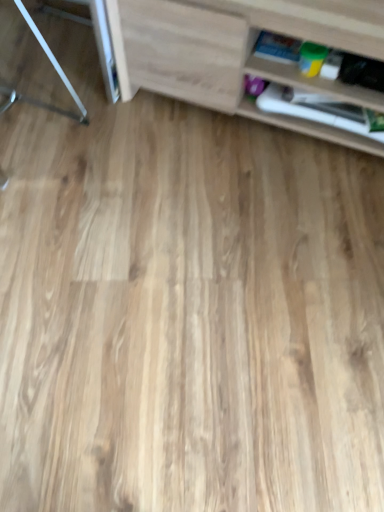
Question: From a real-world perspective, relative to wooden shelf at right, the 1th shelf when ordered from back to front, is metallic silver table at left vertically above or below?

Choices:
 (A) above
 (B) below

Answer: (A)

Question: Looking at the image, does metallic silver table at left seem bigger or smaller compared to wooden shelf at right, the 1th shelf when ordered from back to front?

Choices:
 (A) big
 (B) small

Answer: (A)

Question: Considering the real-world distances, which object is closest to the light wood cabinet at upper right, which appears as the second shelf when viewed from the back?

Choices:
 (A) metallic silver table at left
 (B) wooden shelf at right, marked as the second shelf in a front-to-back arrangement

Answer: (B)

Question: Based on their relative distances, which object is farther from the wooden shelf at right, the 1th shelf when ordered from back to front?

Choices:
 (A) light wood cabinet at upper right, placed as the 1th shelf when sorted from front to back
 (B) metallic silver table at left

Answer: (B)